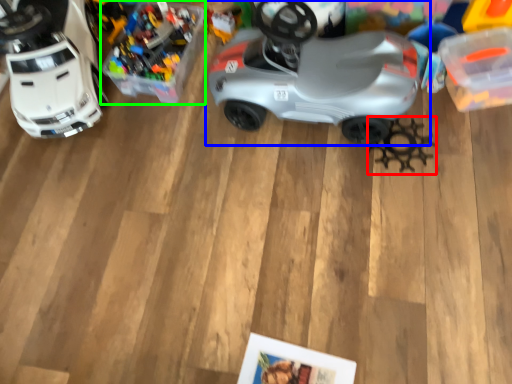
Question: Considering the real-world distances, which object is closest to toy (highlighted by a red box)? car (highlighted by a blue box) or toy (highlighted by a green box).

Choices:
 (A) car
 (B) toy

Answer: (A)